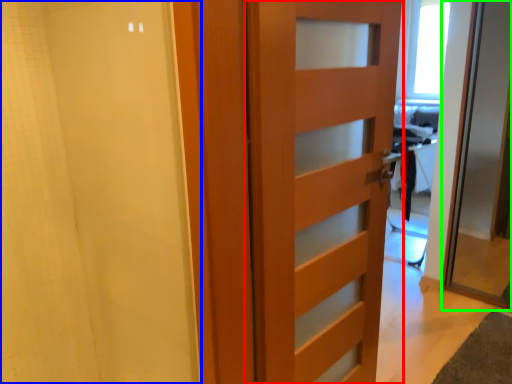
Question: Based on their relative distances, which object is nearer to door (highlighted by a red box)? Choose from shower curtain (highlighted by a blue box) and door (highlighted by a green box).

Choices:
 (A) shower curtain
 (B) door

Answer: (A)